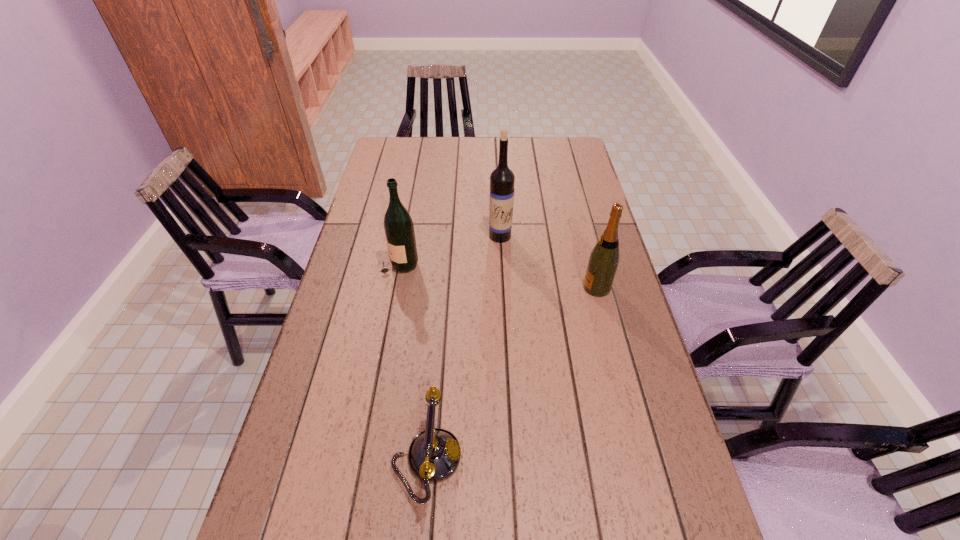
At what (x,y) coordinates should I click in order to perform the action: click on vacant point located between the tallest wine bottle and the leftmost wine bottle. Please return your answer as a coordinate pair (x, y). This screenshot has width=960, height=540. Looking at the image, I should click on (450, 249).

Image resolution: width=960 pixels, height=540 pixels. I want to click on free space between the third nearest object and the second object from left to right, so click(413, 361).

Identify the location of vacant space that's between the nearest object and the leftmost wine bottle. The height and width of the screenshot is (540, 960). (413, 361).

Find the location of a particular element. This screenshot has width=960, height=540. free space between the tallest object and the leftmost object is located at coordinates (450, 249).

Locate an element on the screen. free point between the leftmost object and the rightmost wine bottle is located at coordinates (498, 275).

You are a GUI agent. You are given a task and a screenshot of the screen. Output one action in this format:
    pyautogui.click(x=<x>, y=<y>)
    Task: Click on the empty space between the rightmost wine bottle and the third nearest object
    Image resolution: width=960 pixels, height=540 pixels.
    Given the screenshot: What is the action you would take?
    pyautogui.click(x=498, y=275)

The width and height of the screenshot is (960, 540). I want to click on free space between the third farthest object and the farthest wine bottle, so click(548, 262).

The width and height of the screenshot is (960, 540). Find the location of `unoccupied area between the leftmost object and the second object from left to right`. unoccupied area between the leftmost object and the second object from left to right is located at coordinates (413, 361).

You are a GUI agent. You are given a task and a screenshot of the screen. Output one action in this format:
    pyautogui.click(x=<x>, y=<y>)
    Task: Click on the vacant region between the tallest object and the rightmost wine bottle
    Image resolution: width=960 pixels, height=540 pixels.
    Given the screenshot: What is the action you would take?
    pyautogui.click(x=548, y=262)

Where is `object identified as the closest to the third object from right to left`? Image resolution: width=960 pixels, height=540 pixels. object identified as the closest to the third object from right to left is located at coordinates coord(399,229).